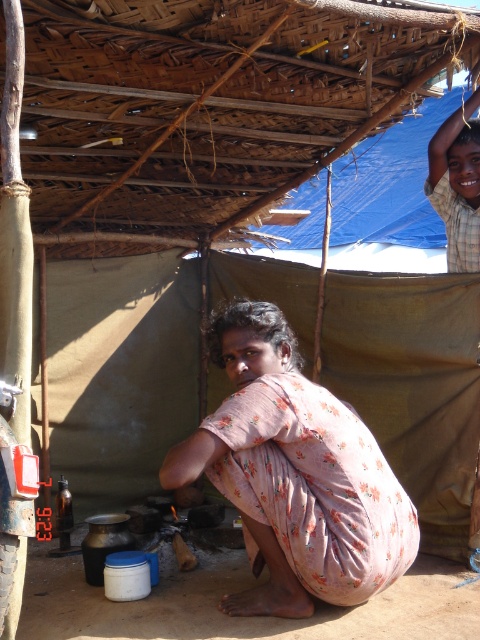
Who is taller, bamboo mat at upper center or light brown wooden headband at upper right?

Standing taller between the two is bamboo mat at upper center.

Locate an element on the screen. The height and width of the screenshot is (640, 480). bamboo mat at upper center is located at coordinates (212, 104).

Who is shorter, bamboo mat at upper center or floral cotton dress at center?

bamboo mat at upper center

Between point (232, 65) and point (262, 595), which one is positioned behind?

The point (232, 65) is behind.

Locate an element on the screen. bamboo mat at upper center is located at coordinates (212, 104).

Measure the distance between floral cotton dress at center and camera.

floral cotton dress at center and camera are 9.20 feet apart from each other.

Describe the element at coordinates (295, 474) in the screenshot. I see `floral cotton dress at center` at that location.

Which is in front, point (308, 456) or point (447, 250)?

Point (308, 456) is in front.

Identify the location of floral cotton dress at center. The height and width of the screenshot is (640, 480). (295, 474).